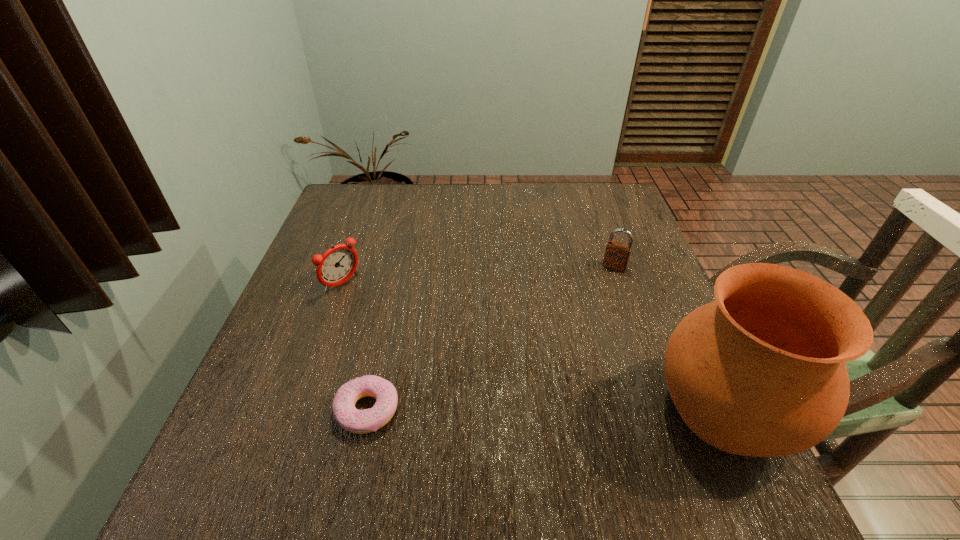
Find the location of a particular element. This screenshot has width=960, height=540. doughnut is located at coordinates (356, 421).

At what (x,y) coordinates should I click in order to perform the action: click on the third object from right to left. Please return your answer as a coordinate pair (x, y). Looking at the image, I should click on (356, 421).

The width and height of the screenshot is (960, 540). Find the location of `pottery`. pottery is located at coordinates (760, 371).

Locate an element on the screen. padlock is located at coordinates (617, 255).

The image size is (960, 540). I want to click on the leftmost object, so click(336, 266).

This screenshot has height=540, width=960. I want to click on vacant point located 0.090m on the back of the shortest object, so click(x=381, y=349).

The image size is (960, 540). I want to click on free location located 0.310m on the left of the pottery, so click(487, 410).

You are a GUI agent. You are given a task and a screenshot of the screen. Output one action in this format:
    pyautogui.click(x=<x>, y=<y>)
    Task: Click on the blank area located on the front-facing side of the padlock
    Image resolution: width=960 pixels, height=540 pixels.
    Given the screenshot: What is the action you would take?
    pyautogui.click(x=572, y=343)

You are a GUI agent. You are given a task and a screenshot of the screen. Output one action in this format:
    pyautogui.click(x=<x>, y=<y>)
    Task: Click on the blank space located on the front-facing side of the padlock
    This screenshot has width=960, height=540.
    Given the screenshot: What is the action you would take?
    601,291

Image resolution: width=960 pixels, height=540 pixels. Identify the location of free space located 0.310m on the front-facing side of the padlock. (565, 356).